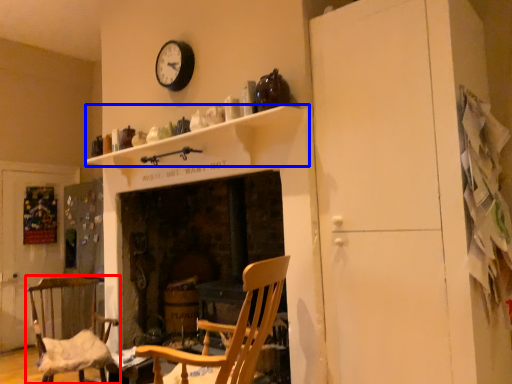
Question: Which object is closer to the camera taking this photo, chair (highlighted by a red box) or mantle (highlighted by a blue box)?

Choices:
 (A) chair
 (B) mantle

Answer: (B)